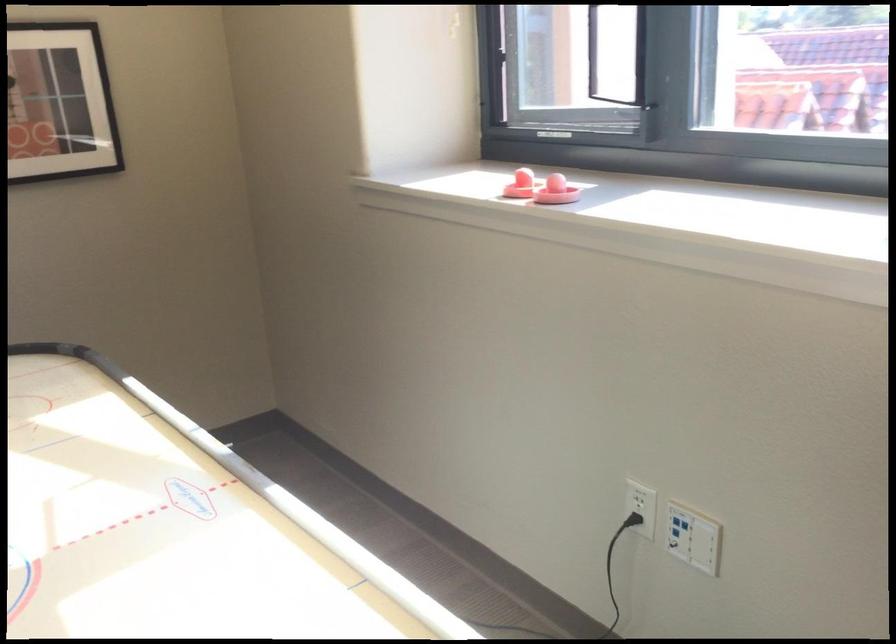
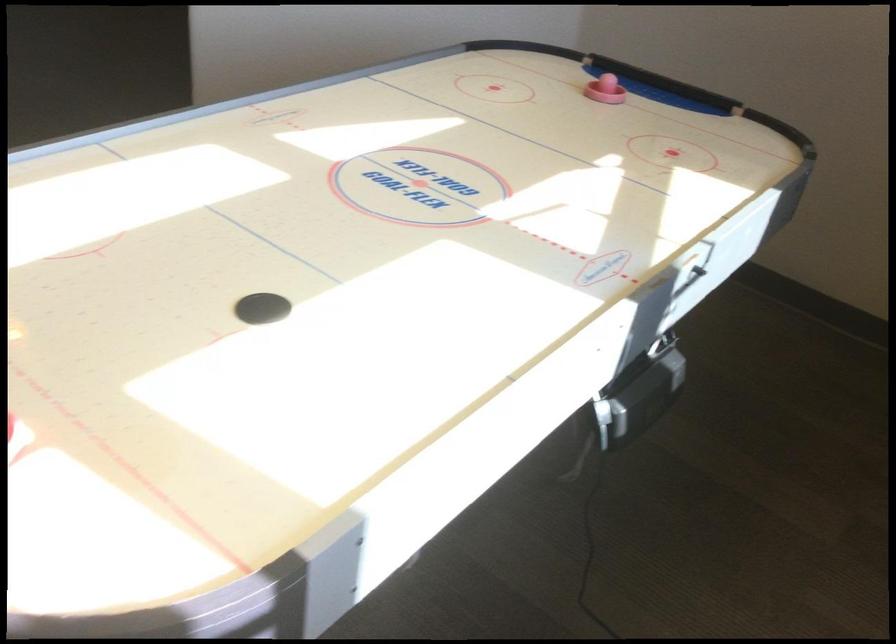
First-person continuous shooting, in which direction is the camera rotating?

The camera rotated toward left-down.